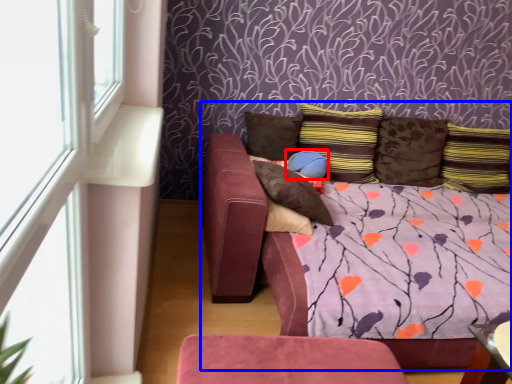
Question: Which object appears farthest to the camera in this image, pillow (highlighted by a red box) or studio couch (highlighted by a blue box)?

Choices:
 (A) pillow
 (B) studio couch

Answer: (A)